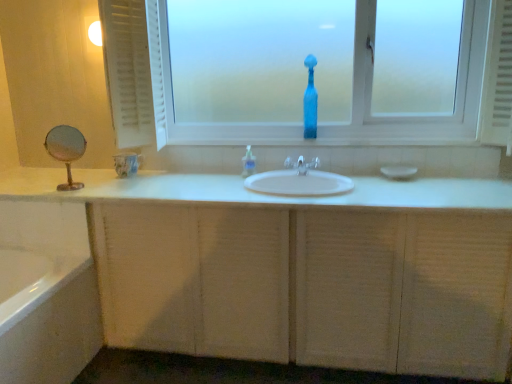
At what (x,y) coordinates should I click in order to perform the action: click on vacant space underneath white matte soap at center (from a real-world perspective). Please return your answer as a coordinate pair (x, y). The image size is (512, 384). Looking at the image, I should click on (400, 174).